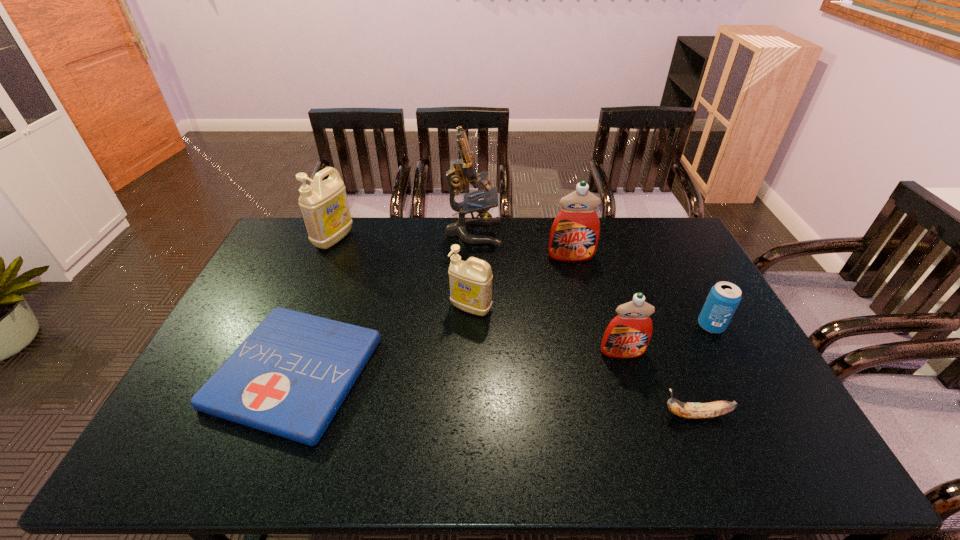
Locate an element on the screen. The height and width of the screenshot is (540, 960). object present at the near left corner is located at coordinates (290, 376).

Where is `vacant region at the far edge`? The width and height of the screenshot is (960, 540). vacant region at the far edge is located at coordinates (626, 244).

The image size is (960, 540). In the image, there is a desktop. Find the location of `vacant space at the near edge`. vacant space at the near edge is located at coordinates (387, 457).

In order to click on free space at the left edge of the desktop in this screenshot , I will do `click(224, 431)`.

Find the location of a particular element. The height and width of the screenshot is (540, 960). free region at the right edge of the desktop is located at coordinates (739, 337).

Image resolution: width=960 pixels, height=540 pixels. In the image, there is a desktop. Find the location of `vacant space at the far right corner`. vacant space at the far right corner is located at coordinates (686, 241).

At what (x,y) coordinates should I click in order to perform the action: click on empty location between the smaller beige detergent and the left beige detergent. Please return your answer as a coordinate pair (x, y). Image resolution: width=960 pixels, height=540 pixels. Looking at the image, I should click on (402, 273).

The width and height of the screenshot is (960, 540). What are the coordinates of `free space that is in between the smaller red detergent and the farther red detergent` in the screenshot? It's located at (597, 304).

This screenshot has height=540, width=960. Identify the location of vacant area that lies between the second nearest detergent and the sixth tallest object. pos(591,317).

Image resolution: width=960 pixels, height=540 pixels. Find the location of `unoccupied position between the smaller red detergent and the smaller beige detergent`. unoccupied position between the smaller red detergent and the smaller beige detergent is located at coordinates (547, 330).